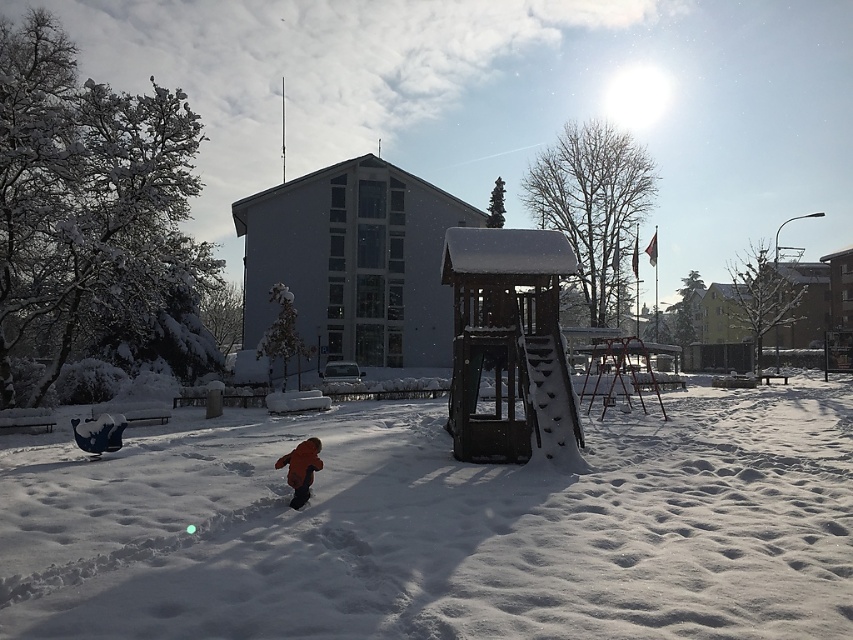
Question: Which of the following is the farthest from the observer?

Choices:
 (A) white fluffy snow at center
 (B) orange fuzzy coat at center

Answer: (B)

Question: Can you confirm if white fluffy snow at center is wider than orange fuzzy coat at center?

Choices:
 (A) no
 (B) yes

Answer: (B)

Question: Is white fluffy snow at center to the left of orange fuzzy coat at center from the viewer's perspective?

Choices:
 (A) no
 (B) yes

Answer: (A)

Question: Can you confirm if white fluffy snow at center is bigger than orange fuzzy coat at center?

Choices:
 (A) yes
 (B) no

Answer: (A)